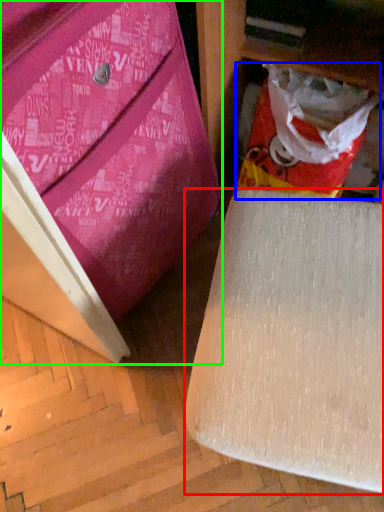
Question: Considering the real-world distances, which object is farthest from furniture (highlighted by a red box)? shopping bag (highlighted by a blue box) or furniture (highlighted by a green box)?

Choices:
 (A) shopping bag
 (B) furniture

Answer: (A)